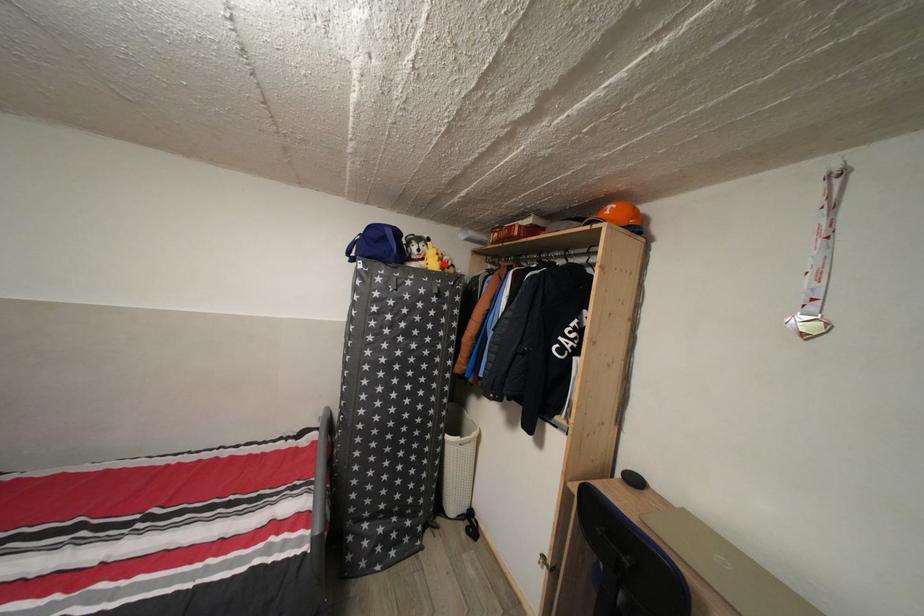
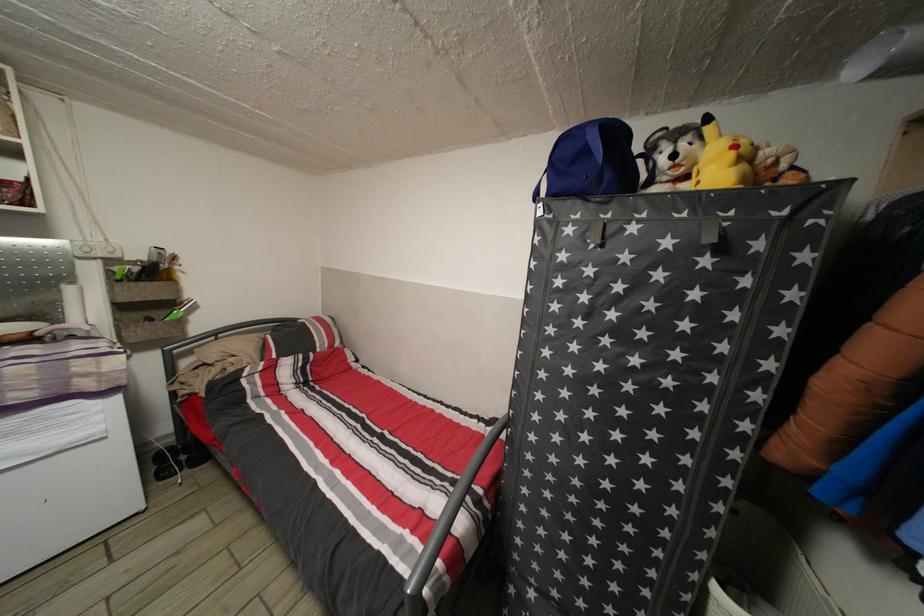
Question: I am providing you with two images of the same scene from different viewpoints. A red point is marked on the first image. Can you still see the location of the red point in image 2?

Choices:
 (A) Yes
 (B) No

Answer: (A)